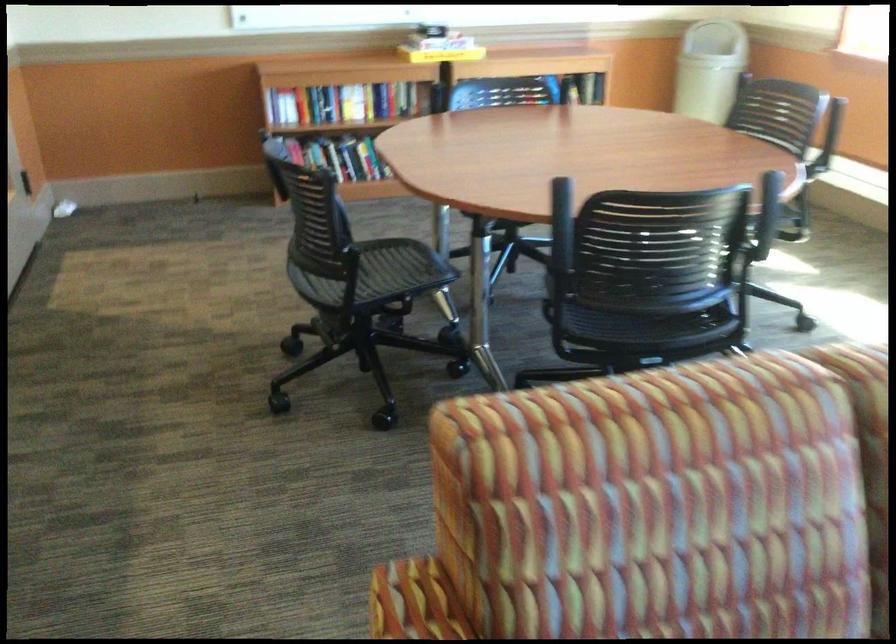
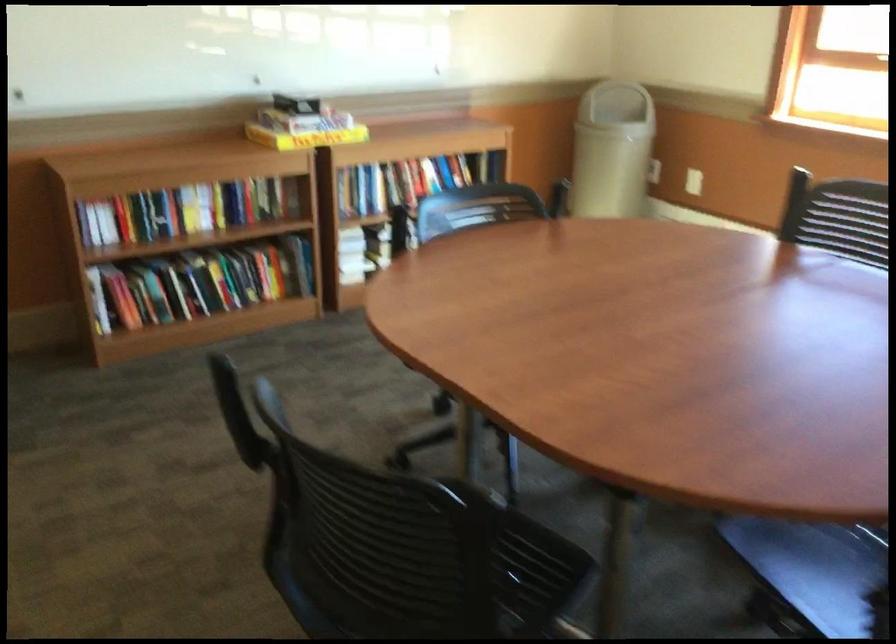
Find the pixel in the second image that matches (x=695, y=73) in the first image.

(612, 149)